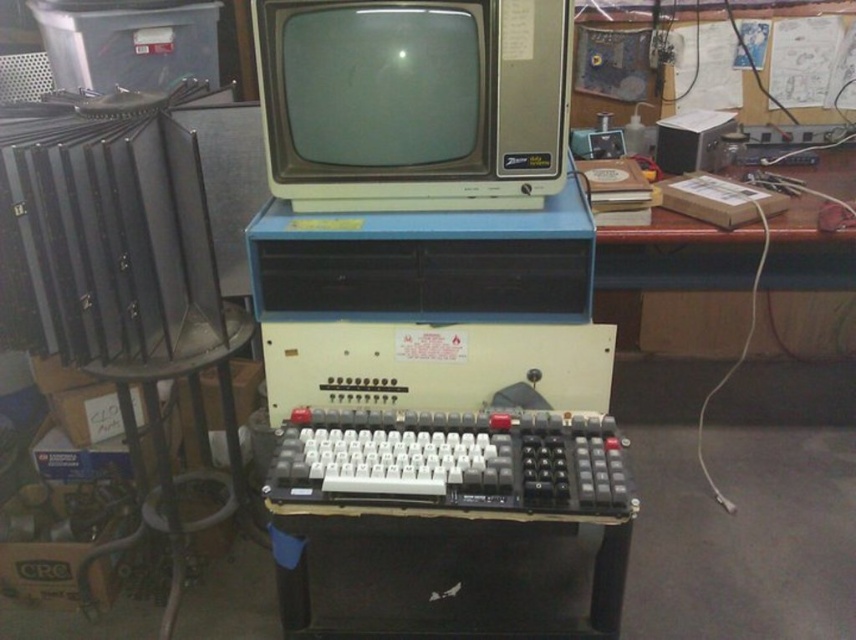
Is point (491, 45) closer to camera compared to point (492, 444)?

Yes, it is in front of point (492, 444).

At what (x,y) coordinates should I click in order to perform the action: click on matte gray crt monitor at center. Please return your answer as a coordinate pair (x, y). The height and width of the screenshot is (640, 856). Looking at the image, I should click on (413, 100).